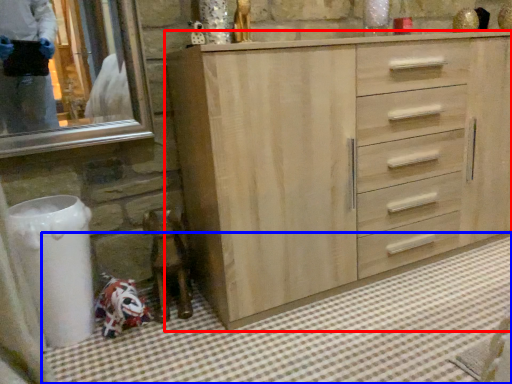
Question: Which object appears farthest to the camera in this image, chest of drawers (highlighted by a red box) or bath mat (highlighted by a blue box)?

Choices:
 (A) chest of drawers
 (B) bath mat

Answer: (A)